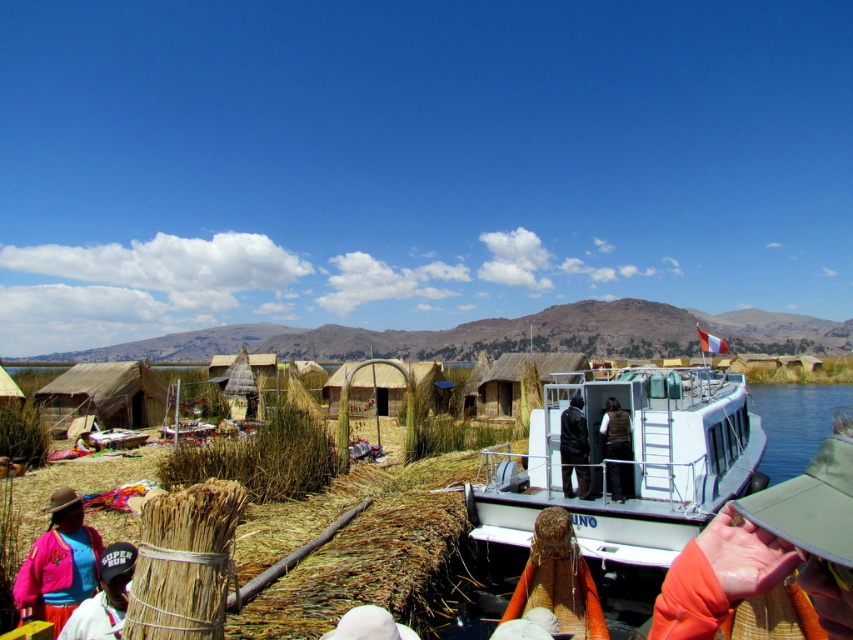
Question: Does white matte boat at center appear on the left side of black leather jacket at center?

Choices:
 (A) no
 (B) yes

Answer: (A)

Question: Among these objects, which one is farthest from the camera?

Choices:
 (A) brown leather vest at center
 (B) white matte boat at center
 (C) multicolored woven fabric at lower left
 (D) orange fabric at lower right

Answer: (A)

Question: Is white matte boat at center wider than matte pink sweater at lower left?

Choices:
 (A) no
 (B) yes

Answer: (B)

Question: Does multicolored woven fabric at lower left have a larger size compared to brown leather vest at center?

Choices:
 (A) yes
 (B) no

Answer: (B)

Question: Among these points, which one is nearest to the camera?

Choices:
 (A) (109, 545)
 (B) (552, 451)
 (C) (577, 410)
 (D) (689, 552)

Answer: (D)

Question: Among these points, which one is nearest to the camera?

Choices:
 (A) (660, 448)
 (B) (730, 593)

Answer: (B)